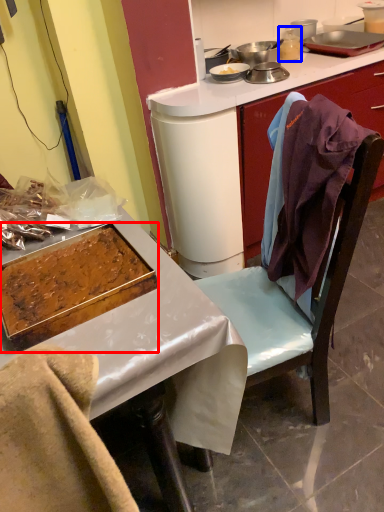
Question: Among these objects, which one is farthest to the camera, kitchen appliance (highlighted by a red box) or appliance (highlighted by a blue box)?

Choices:
 (A) kitchen appliance
 (B) appliance

Answer: (B)